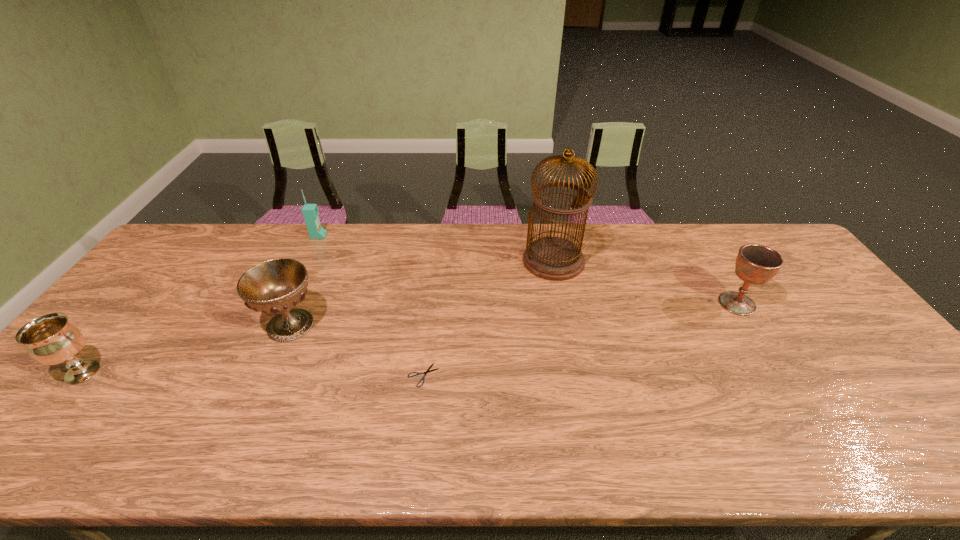
Where is `the second object from right to left`? the second object from right to left is located at coordinates (553, 258).

Where is `the second farthest object`? the second farthest object is located at coordinates (553, 258).

Find the location of a particular element. cellular telephone is located at coordinates (310, 212).

Image resolution: width=960 pixels, height=540 pixels. Identify the location of the rightmost chalice. (756, 264).

Find the location of `the second chalice from right to left`. the second chalice from right to left is located at coordinates (276, 286).

The width and height of the screenshot is (960, 540). I want to click on the leftmost object, so click(49, 339).

Where is `the nearest chalice`? The image size is (960, 540). the nearest chalice is located at coordinates (49, 339).

Find the location of a particular element. the shortest object is located at coordinates (418, 373).

The image size is (960, 540). I want to click on shears, so click(418, 373).

I want to click on free region located on the front-facing side of the fifth object from left to right, so click(x=578, y=384).